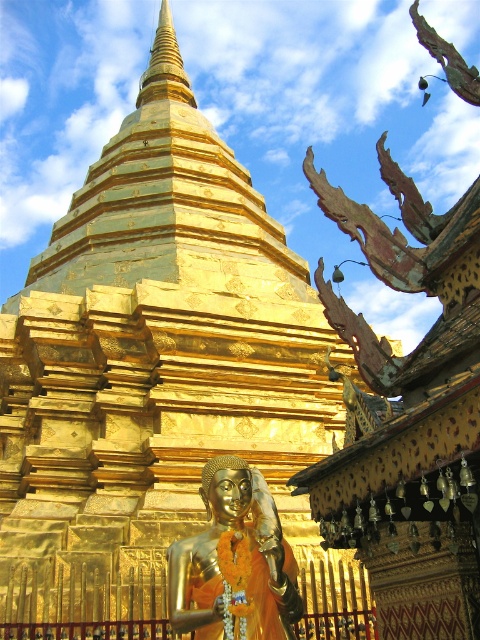
Describe the element at coordinates (233, 563) in the screenshot. Image resolution: width=480 pixels, height=640 pixels. I see `gold metallic statue at center` at that location.

Between point (237, 509) and point (168, 88), which one is positioned in front?

Point (237, 509) is more forward.

Locate an element on the screen. This screenshot has height=640, width=480. gold metallic statue at center is located at coordinates (233, 563).